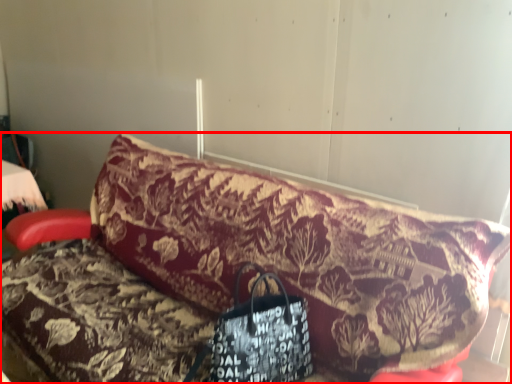
Question: From the image's perspective, what is the correct spatial positioning of furniture (annotated by the red box) in reference to handbag?

Choices:
 (A) below
 (B) above

Answer: (B)